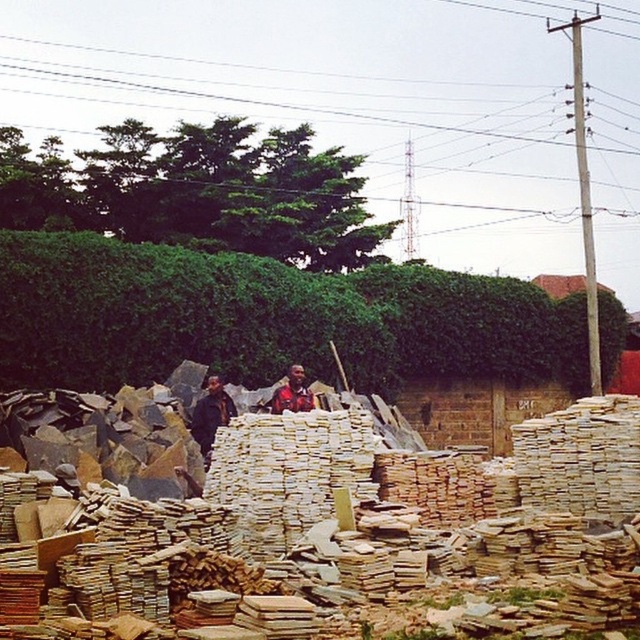
Question: Which of the following is the farthest from the observer?

Choices:
 (A) matte brown shirt at center
 (B) natural stone blocks at center
 (C) dark brown leather jacket at center

Answer: (C)

Question: Does natural stone blocks at center come behind dark brown leather jacket at center?

Choices:
 (A) no
 (B) yes

Answer: (A)

Question: Which point is closer to the camera taking this photo?

Choices:
 (A) (214, 566)
 (B) (241, 314)
 (C) (228, 406)

Answer: (A)

Question: Estimate the real-world distances between objects in this image. Which object is farther from the green leafy hedge at center?

Choices:
 (A) dark brown leather jacket at center
 (B) matte brown shirt at center
 (C) natural stone blocks at center

Answer: (C)

Question: Can you confirm if green leafy hedge at center is positioned below dark brown leather jacket at center?

Choices:
 (A) no
 (B) yes

Answer: (A)

Question: Is natural stone blocks at center to the right of dark brown leather jacket at center from the viewer's perspective?

Choices:
 (A) yes
 (B) no

Answer: (A)